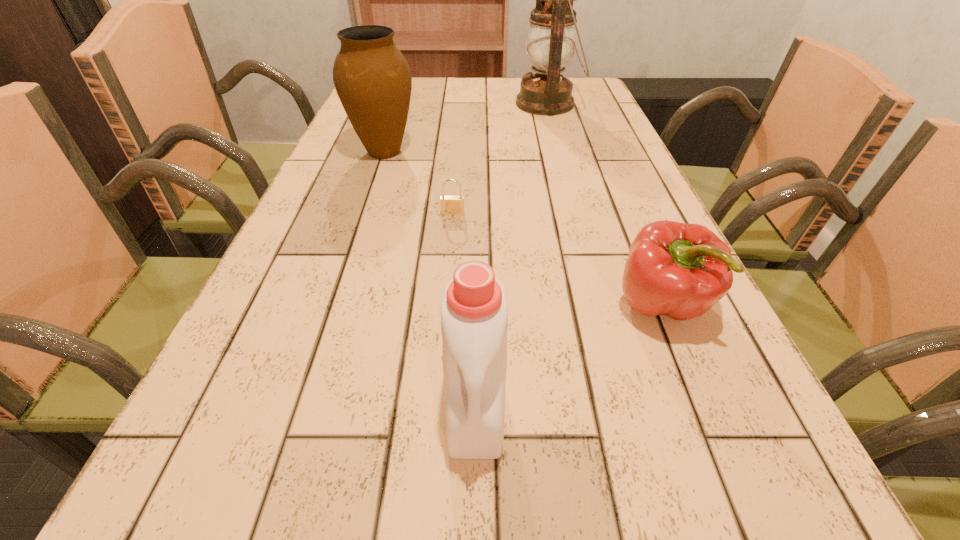
The height and width of the screenshot is (540, 960). Identify the location of free spot at the left edge of the desktop. (295, 241).

The width and height of the screenshot is (960, 540). I want to click on free space at the right edge of the desktop, so click(684, 455).

The height and width of the screenshot is (540, 960). Identify the location of free point between the tallest object and the second shortest object. (605, 204).

The height and width of the screenshot is (540, 960). In order to click on vacant space that's between the urn and the shortest object in this screenshot , I will do `click(419, 183)`.

Locate an element on the screen. Image resolution: width=960 pixels, height=540 pixels. vacant space in between the third shortest object and the tallest object is located at coordinates tap(512, 255).

Identify the location of free space between the lantern and the detergent. This screenshot has width=960, height=540. (512, 255).

Where is `vacant area that lies between the third shortest object and the lantern`? This screenshot has height=540, width=960. vacant area that lies between the third shortest object and the lantern is located at coordinates (512, 255).

Find the location of `free spot between the farthest object and the second tallest object`. free spot between the farthest object and the second tallest object is located at coordinates (467, 127).

The width and height of the screenshot is (960, 540). I want to click on blank region between the third farthest object and the pepper, so click(x=558, y=259).

In order to click on free area in between the farthest object and the detergent in this screenshot , I will do `click(512, 255)`.